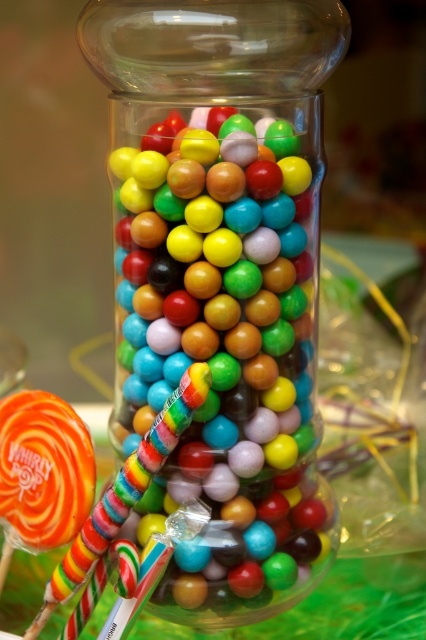
Can you confirm if transparent glass jar at center is positioned above multicolored striped lollipop at lower left?

Indeed, transparent glass jar at center is positioned over multicolored striped lollipop at lower left.

At what (x,y) coordinates should I click in order to perform the action: click on transparent glass jar at center. Please return your answer as a coordinate pair (x, y). Looking at the image, I should click on (221, 276).

Is point (103, 60) behind point (91, 554)?

Yes.

Where is `transparent glass jar at center`? The width and height of the screenshot is (426, 640). transparent glass jar at center is located at coordinates (221, 276).